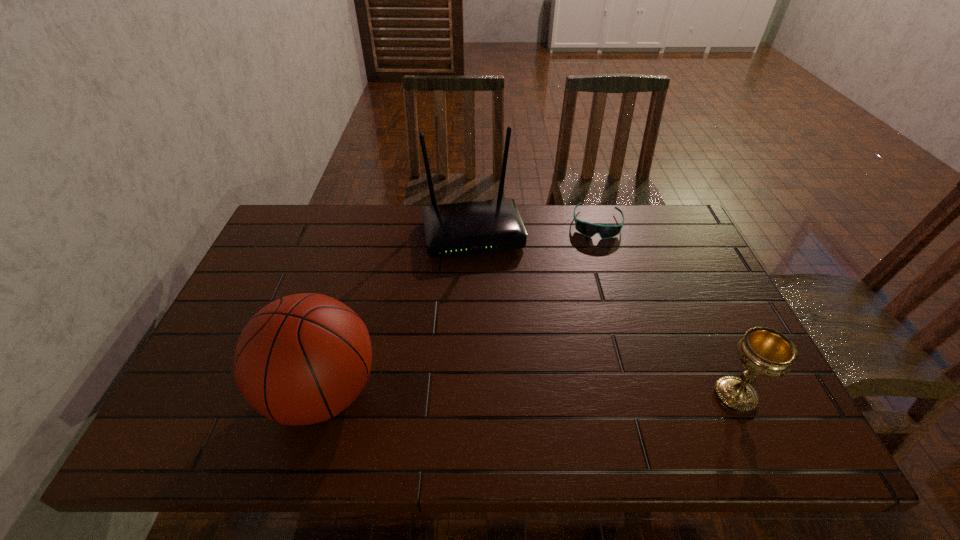
You are a GUI agent. You are given a task and a screenshot of the screen. Output one action in this format:
    pyautogui.click(x=<x>, y=<y>)
    Task: Click on the leftmost object
    
    Given the screenshot: What is the action you would take?
    pyautogui.click(x=302, y=359)

Locate an element on the screen. The height and width of the screenshot is (540, 960). the second shortest object is located at coordinates (763, 351).

Where is `chalice`? This screenshot has height=540, width=960. chalice is located at coordinates (763, 351).

I want to click on the third object from right to left, so click(463, 228).

Where is `the third object from left to right`? the third object from left to right is located at coordinates (588, 229).

Locate an element on the screen. the shortest object is located at coordinates (588, 229).

This screenshot has width=960, height=540. In order to click on free space located on the back of the basketball in this screenshot , I will do `click(357, 273)`.

At what (x,y) coordinates should I click in order to perform the action: click on blank space located on the left of the rightmost object. Please return your answer as a coordinate pair (x, y). Image resolution: width=960 pixels, height=540 pixels. Looking at the image, I should click on (685, 395).

This screenshot has width=960, height=540. Find the location of `vacant space situated on the front-facing side of the router`. vacant space situated on the front-facing side of the router is located at coordinates (504, 352).

Find the location of a particular element. The height and width of the screenshot is (540, 960). vacant area located 0.130m on the front-facing side of the router is located at coordinates (490, 293).